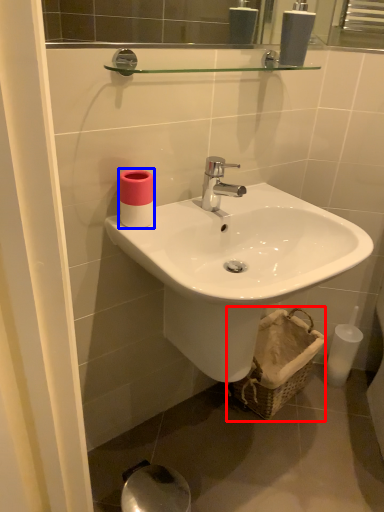
Question: Which object appears farthest to the camera in this image, basket (highlighted by a red box) or toiletry (highlighted by a blue box)?

Choices:
 (A) basket
 (B) toiletry

Answer: (A)